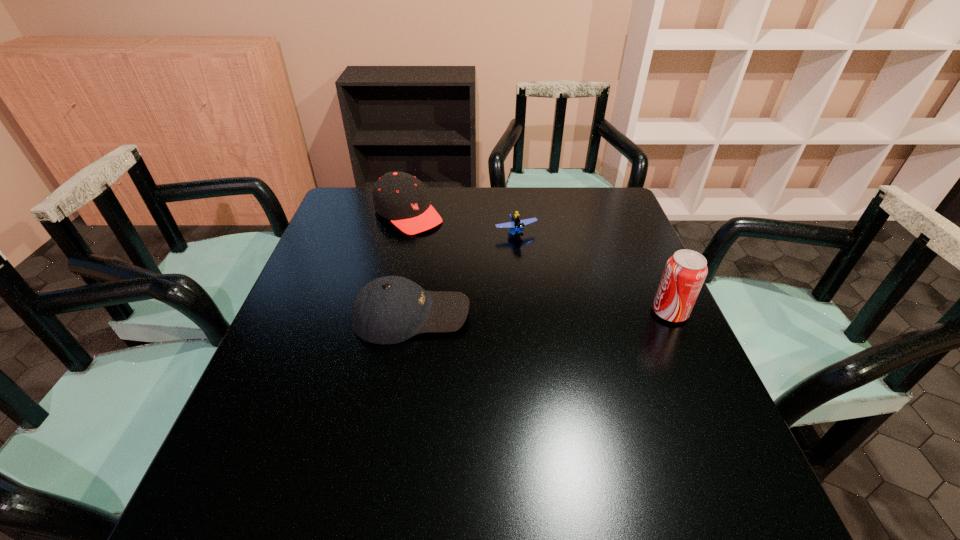
Identify the location of vacant space on the desktop that is between the second shortest object and the soda can and is positioned on the front-facing side of the cap. (535, 314).

Locate an element on the screen. This screenshot has width=960, height=540. vacant space on the desktop that is between the second shortest object and the tallest object and is positioned on the front-facing side of the shortest object is located at coordinates (566, 313).